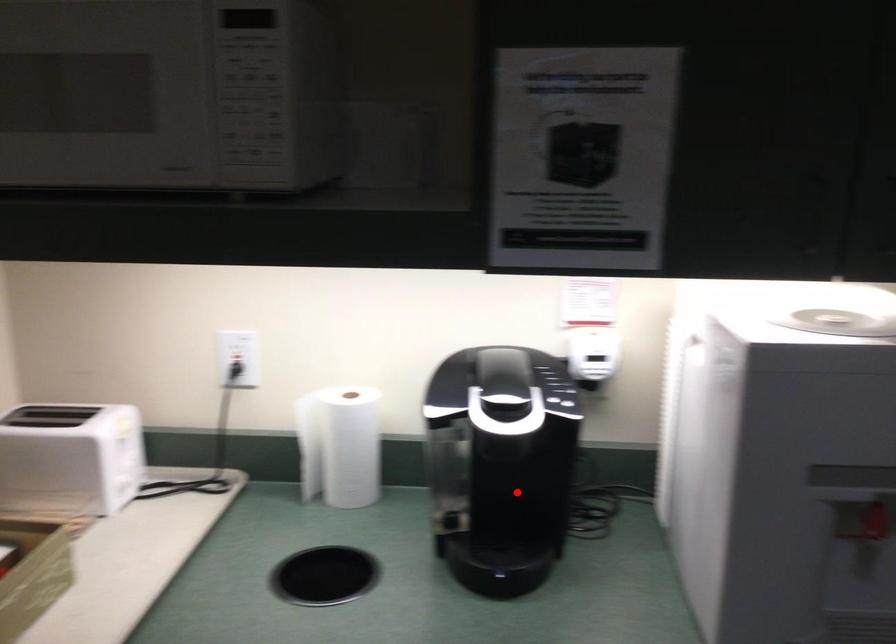
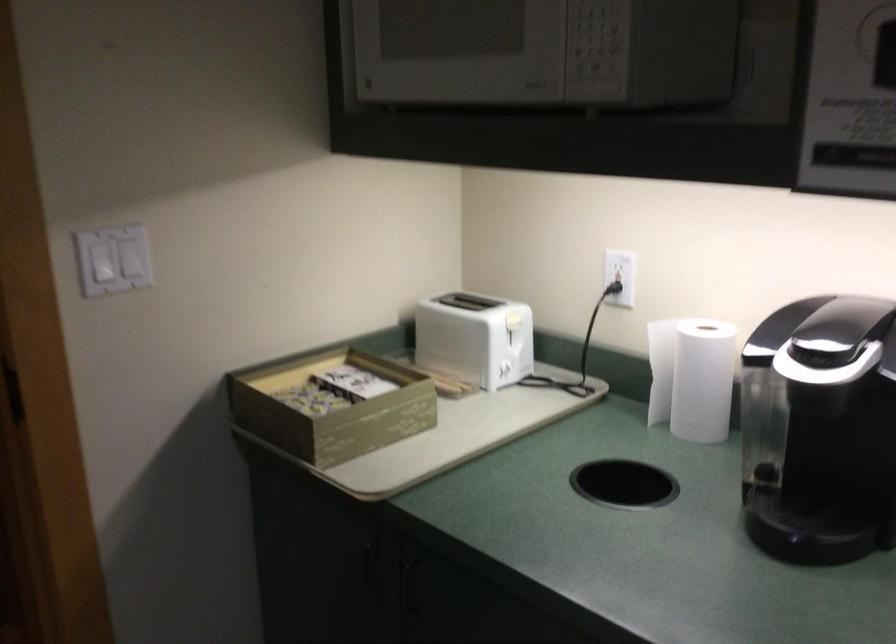
Question: I am providing you with two images of the same scene from different viewpoints. Image1 has a red point marked. In image2, the corresponding 3D location appears at what relative position? Reply with the corresponding letter.

Choices:
 (A) Closer
 (B) Farther

Answer: (A)